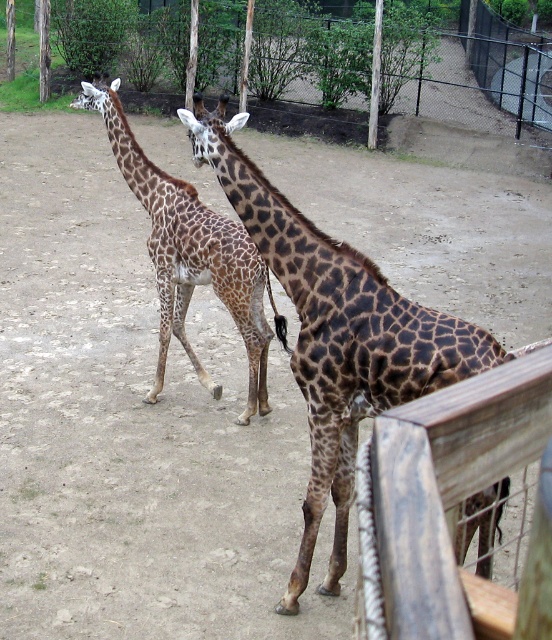
Can you confirm if wooden fence at right is shorter than brown spotted giraffe at center?

Indeed, wooden fence at right has a lesser height compared to brown spotted giraffe at center.

Describe the element at coordinates (449, 504) in the screenshot. I see `wooden fence at right` at that location.

Locate an element on the screen. wooden fence at right is located at coordinates (449, 504).

Can you confirm if wooden fence at upper center is taller than brown spotted giraffe at center?

No, wooden fence at upper center is not taller than brown spotted giraffe at center.

Which is more to the left, wooden fence at upper center or brown spotted giraffe at center?

brown spotted giraffe at center is more to the left.

Is point (242, 17) in front of point (161, 236)?

No, it is behind (161, 236).

Identify the location of wooden fence at upper center. The height and width of the screenshot is (640, 552). (465, 72).

Can you confirm if wooden fence at upper center is taller than spotted fur giraffe at center?

No, wooden fence at upper center is not taller than spotted fur giraffe at center.

Is point (475, 48) behind point (342, 493)?

Yes, it is behind point (342, 493).

You are a GUI agent. You are given a task and a screenshot of the screen. Output one action in this format:
    pyautogui.click(x=<x>, y=<y>)
    Task: Click on the wooden fence at upper center
    This screenshot has width=552, height=640.
    Given the screenshot: What is the action you would take?
    point(465,72)